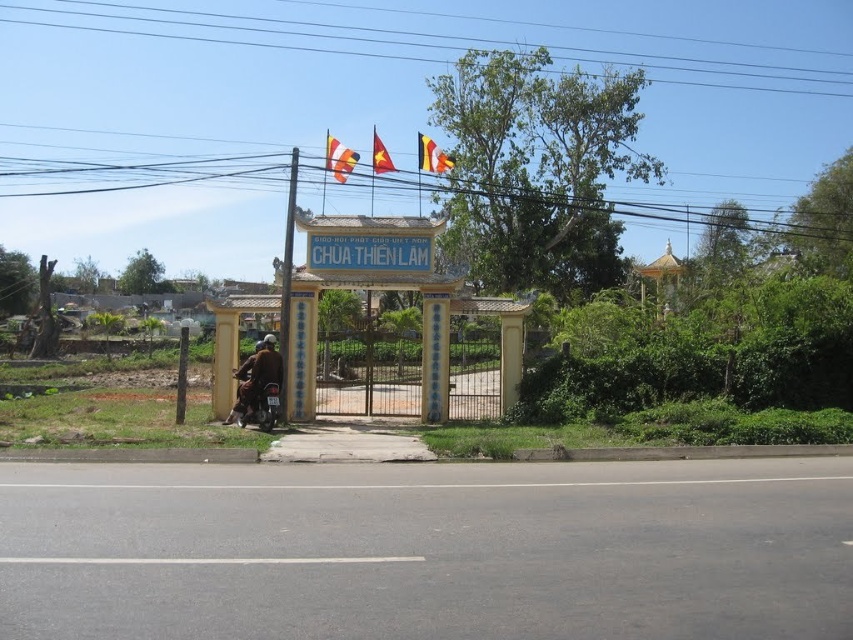
You are standing at the entrance of Chua Thien Lam and notice two flags above the gate. Which flag is taller between the orange fabric flag at upper center and the yellow fabric flag at upper center?

The orange fabric flag at upper center is much taller than the yellow fabric flag at upper center.

You are standing at the entrance of Chua Thien Lam and looking up at the flags displayed above the gate. The orange fabric flag at upper center is positioned at coordinates 0.248, 0.397. If you were to draw a vertical line from the flag down to the ground, which object from the scene would it intersect first?

The vertical line drawn from the orange fabric flag at upper center would intersect the yellow pillars of the gate first, as they are the closest structure directly below the flag.

You are a visitor at Chua Thien Lam and notice the brown leather jacket at lower left and the orange fabric flag at upper center. Which object is larger in size?

The orange fabric flag at upper center is larger than the brown leather jacket at lower left.